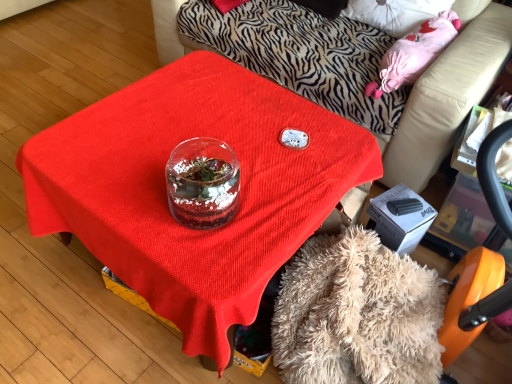
Question: From a real-world perspective, is transparent glass terrarium at center above or below fuzzy beige blanket at lower center?

Choices:
 (A) above
 (B) below

Answer: (A)

Question: From the image's perspective, is transparent glass terrarium at center positioned above or below fuzzy beige blanket at lower center?

Choices:
 (A) above
 (B) below

Answer: (A)

Question: Based on their relative distances, which object is nearer to the fuzzy beige blanket at lower center?

Choices:
 (A) transparent glass jar at center
 (B) transparent glass terrarium at center

Answer: (B)

Question: Which object is the closest to the transparent glass terrarium at center?

Choices:
 (A) fuzzy beige blanket at lower center
 (B) transparent glass jar at center

Answer: (A)